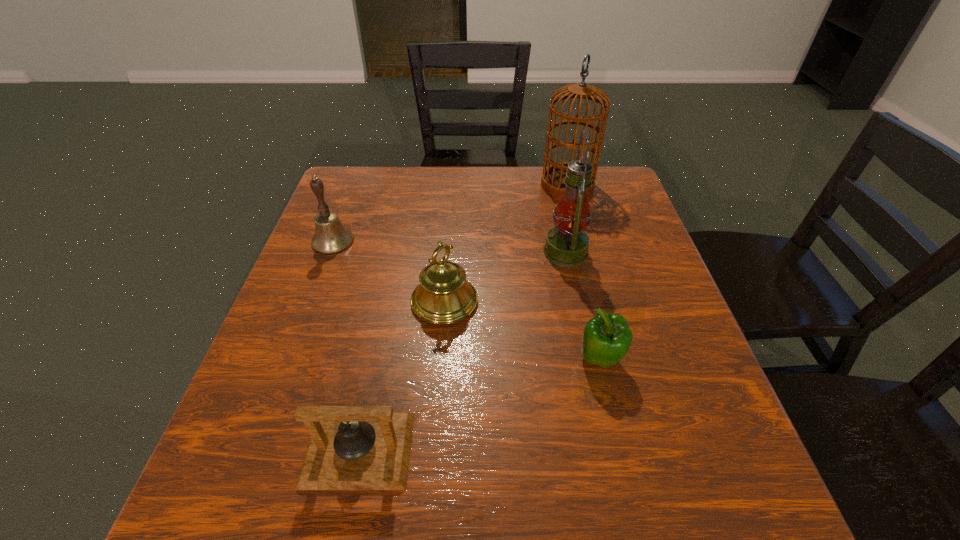
I want to click on free space that is in between the second tallest bell and the oil lamp, so click(x=505, y=276).

Locate an element on the screen. This screenshot has width=960, height=540. vacant point located between the second tallest bell and the tallest object is located at coordinates (506, 243).

You are a GUI agent. You are given a task and a screenshot of the screen. Output one action in this format:
    pyautogui.click(x=<x>, y=<y>)
    Task: Click on the free spot between the second tallest object and the shortest object
    
    Given the screenshot: What is the action you would take?
    pyautogui.click(x=462, y=350)

Locate which object is the closest to the shortest object. Please provide its 2D coordinates. Your answer should be formatted as a tuple, i.e. [(x, y)], where the tuple contains the x and y coordinates of a point satisfying the conditions above.

[(444, 296)]

Choose which object is the nearest neighbor to the leftmost bell. Please provide its 2D coordinates. Your answer should be formatted as a tuple, i.e. [(x, y)], where the tuple contains the x and y coordinates of a point satisfying the conditions above.

[(444, 296)]

Locate an element on the screen. bell that is the second nearest to the shortest object is located at coordinates (331, 237).

Where is `bell that is the second closest to the farthest bell`? bell that is the second closest to the farthest bell is located at coordinates (351, 447).

Find the location of a particular element. vacant region that satisfies the following two spatial constraints: 1. on the back side of the fifth farthest object; 2. on the left side of the farthest object is located at coordinates (559, 185).

I want to click on free spot that satisfies the following two spatial constraints: 1. on the front side of the second tallest object; 2. on the left side of the leftmost object, so click(x=329, y=252).

Locate an element on the screen. vacant space that satisfies the following two spatial constraints: 1. on the front side of the fifth farthest object; 2. on the right side of the fifth shortest object is located at coordinates (588, 360).